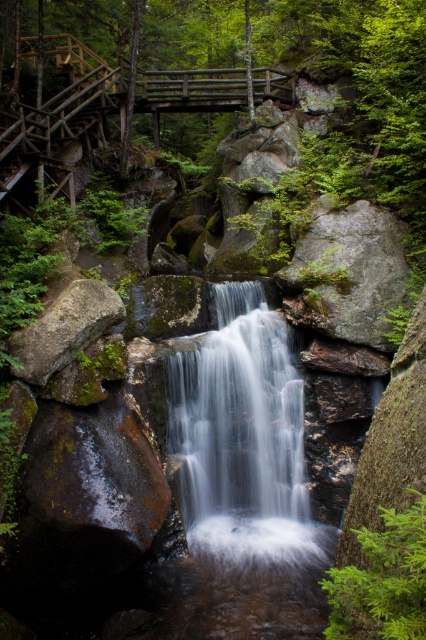
You are a hiker standing at the brown rough rock at lower left and want to reach the smooth gray water at center. Which direction should you move to get there?

You should move to the right to reach the smooth gray water at center since it is located to the right of the brown rough rock at lower left.

You are standing at the base of the waterfall and want to take a photo of both the point at coordinates (253, 490) and the point at (36, 330). Which point is closer to your camera lens?

Point (36, 330) is closer to the camera lens because it is less further to the viewer than point (253, 490).

You are standing on the wooden bridge and looking down at the scene. Which object, the smooth gray water at center or the brown rough rock at lower left, is positioned lower in the image?

The smooth gray water at center is positioned lower than the brown rough rock at lower left in the image.